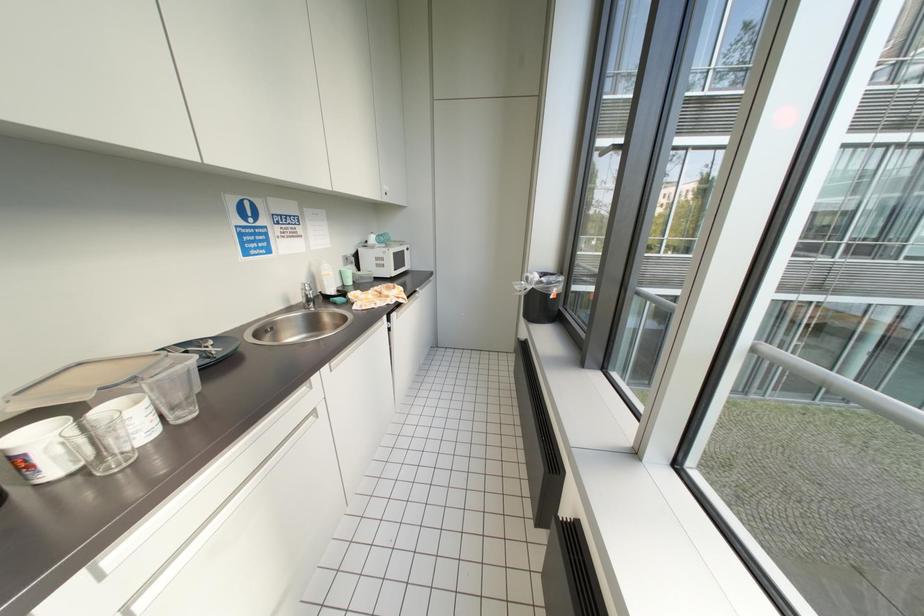
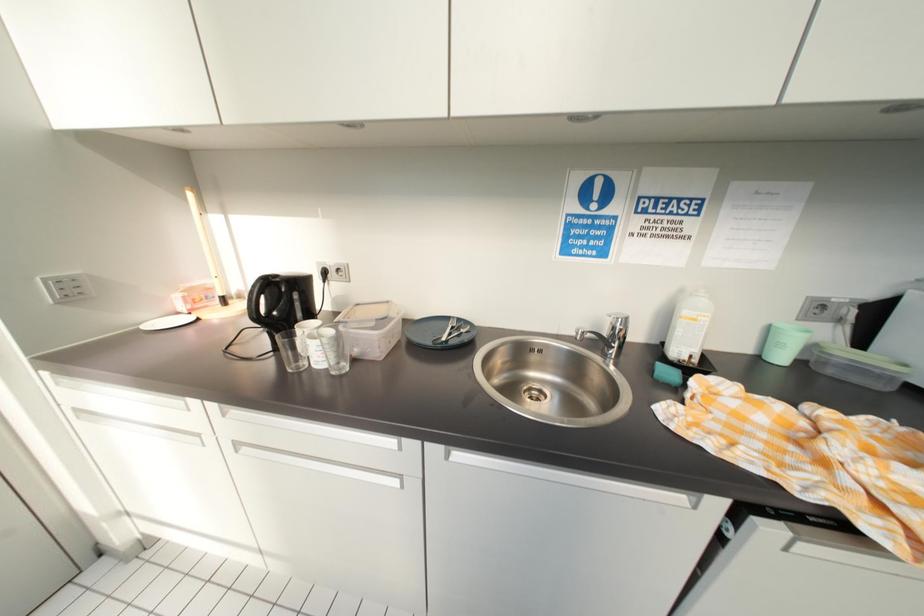
Based on the photo, the images are taken continuously from a first-person perspective. In which direction is your viewpoint rotating?

The camera's rotation is toward left-down.